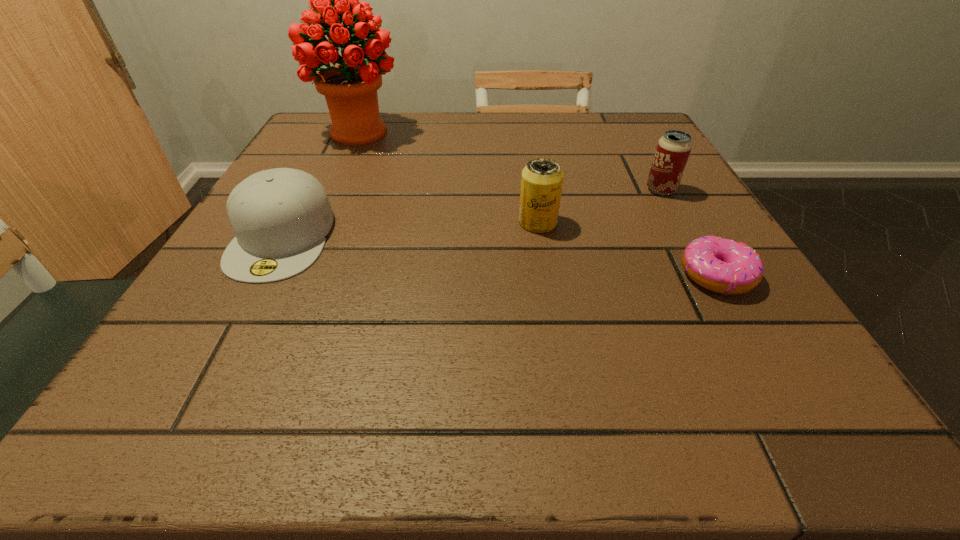
Where is `blank area located on the front of the fourth nearest object`? Image resolution: width=960 pixels, height=540 pixels. blank area located on the front of the fourth nearest object is located at coordinates (735, 323).

The width and height of the screenshot is (960, 540). Identify the location of vacant space located 0.240m on the front-facing side of the cap. (180, 429).

Identify the location of blank area located on the back of the shortest object. (642, 146).

Image resolution: width=960 pixels, height=540 pixels. I want to click on object situated at the far edge, so click(x=350, y=89).

Identify the location of bouquet that is positioned at the left edge. (350, 89).

You are a GUI agent. You are given a task and a screenshot of the screen. Output one action in this format:
    pyautogui.click(x=<x>, y=<y>)
    Task: Click on the cap that is at the left edge
    
    Given the screenshot: What is the action you would take?
    pyautogui.click(x=280, y=217)

The height and width of the screenshot is (540, 960). I want to click on beer can located at the right edge, so click(673, 149).

Identify the location of doughnut positioned at the right edge. This screenshot has width=960, height=540. point(723,266).

Locate an element on the screen. The height and width of the screenshot is (540, 960). object that is at the far left corner is located at coordinates (350, 89).

Image resolution: width=960 pixels, height=540 pixels. I want to click on free location at the far edge of the desktop, so click(x=400, y=154).